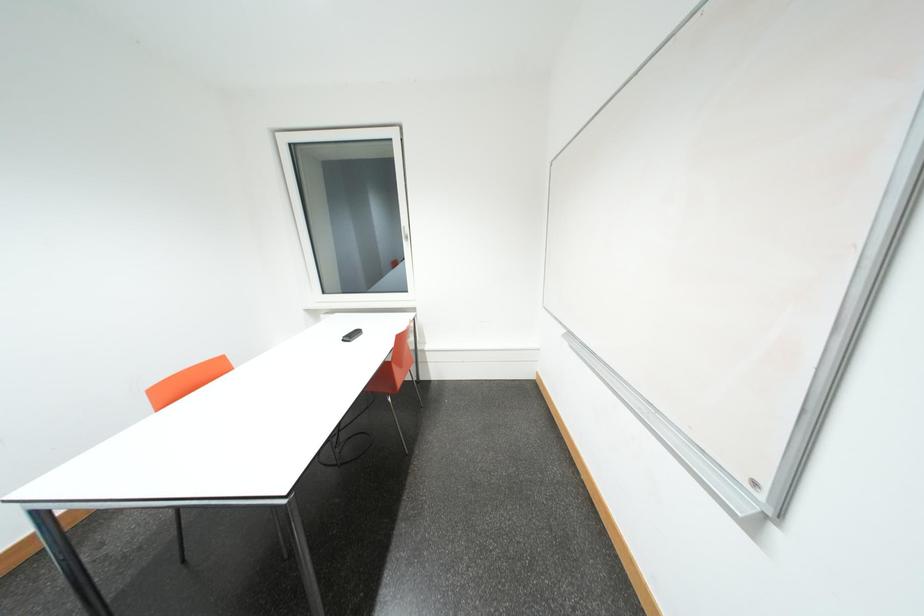
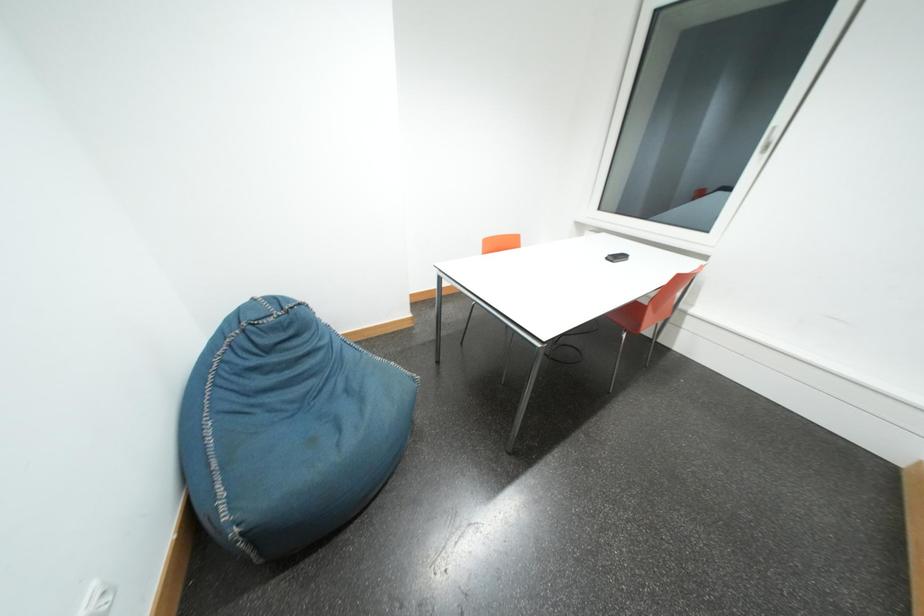
Based on the continuous images, in which direction is the camera rotating?

The camera's rotation is toward left-down.